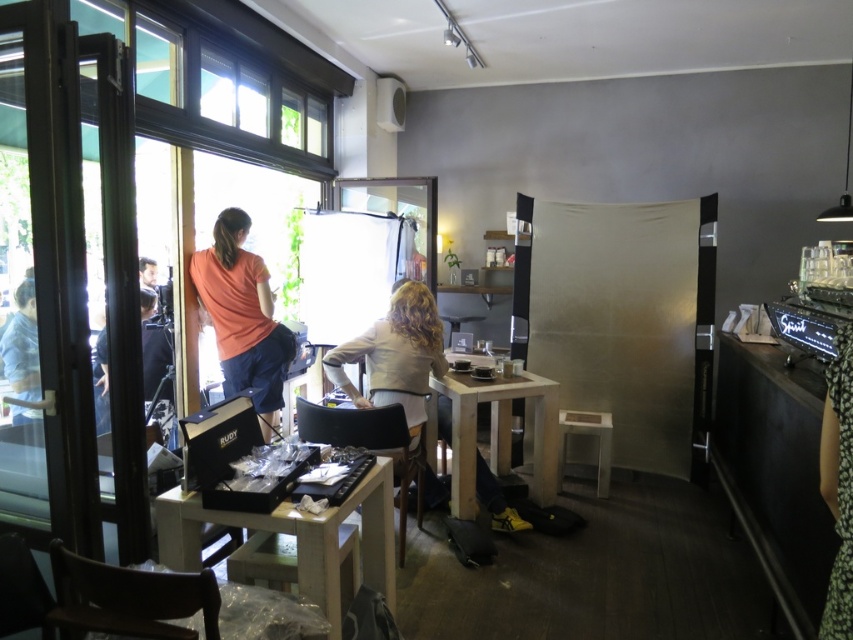
You are a photographer who needs to place a 1.2 meter long tripod on the wooden table at center without blocking the white matte blouse at center. Is there enough space on the table to the left of the blouse to accommodate the tripod?

The wooden table at center is positioned on the left side of white matte blouse at center, so placing the tripod to the left of the blouse would mean placing it further to the left of the table. However, the description does not provide specific measurements of the table or the blouse, so it is unclear if there is enough space. Additional information about the table dimensions or the blouse placement is needed to determine feasibility.

You are standing at the entrance of the space and want to place a new plant stand exactly where the wooden table at center is currently located. According to the coordinates provided, what are the exact coordinates where you should position the plant stand?

The wooden table at center is located at coordinates point (x=296, y=534), so you should position the plant stand at those exact coordinates.

Consider the image. You are standing in the room and want to take a photo of the light wood table at center. To avoid blocking the shot with the orange matte shirt at left, which direction should you move?

The orange matte shirt at left is to the left of the light wood table at center, so you should move to the right to avoid blocking the shot.